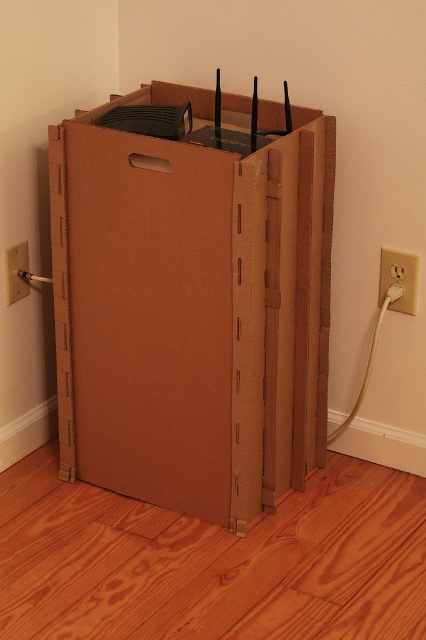
Question: Which point is farther to the camera?

Choices:
 (A) (146, 173)
 (B) (403, 266)
 (C) (22, 241)

Answer: (C)

Question: Can you confirm if white plastic outlet at lower right is smaller than white plastic electric outlet at lower right?

Choices:
 (A) yes
 (B) no

Answer: (B)

Question: Is brown cardboard box at center below white plastic outlet at lower right?

Choices:
 (A) yes
 (B) no

Answer: (A)

Question: Which of the following is the farthest from the observer?

Choices:
 (A) (26, 243)
 (B) (167, 154)

Answer: (A)

Question: Is white plastic outlet at lower right in front of white plastic electric outlet at lower right?

Choices:
 (A) yes
 (B) no

Answer: (A)

Question: Which of the following is the closest to the observer?

Choices:
 (A) white plastic outlet at lower right
 (B) white plastic electric outlet at lower right
 (C) brown cardboard box at center

Answer: (C)